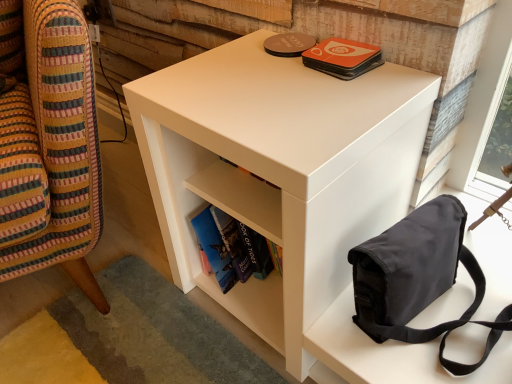
Question: Does white matte nightstand at center have a greater height compared to white matte bookshelf at center?

Choices:
 (A) yes
 (B) no

Answer: (B)

Question: Can you confirm if white matte nightstand at center is bigger than white matte bookshelf at center?

Choices:
 (A) yes
 (B) no

Answer: (A)

Question: Would you say white matte nightstand at center is a long distance from white matte bookshelf at center?

Choices:
 (A) yes
 (B) no

Answer: (B)

Question: Is white matte nightstand at center at the right side of white matte bookshelf at center?

Choices:
 (A) yes
 (B) no

Answer: (B)

Question: Can we say white matte nightstand at center lies outside white matte bookshelf at center?

Choices:
 (A) no
 (B) yes

Answer: (B)

Question: Does white matte nightstand at center have a smaller size compared to white matte bookshelf at center?

Choices:
 (A) no
 (B) yes

Answer: (A)

Question: Considering the relative sizes of orange matte coaster at upper center and white matte side table at lower right in the image provided, is orange matte coaster at upper center taller than white matte side table at lower right?

Choices:
 (A) no
 (B) yes

Answer: (A)

Question: Is orange matte coaster at upper center not within white matte side table at lower right?

Choices:
 (A) yes
 (B) no

Answer: (A)

Question: Can white matte side table at lower right be found inside orange matte coaster at upper center?

Choices:
 (A) yes
 (B) no

Answer: (B)

Question: From a real-world perspective, is orange matte coaster at upper center over white matte side table at lower right?

Choices:
 (A) yes
 (B) no

Answer: (A)

Question: From a real-world perspective, is orange matte coaster at upper center physically below white matte side table at lower right?

Choices:
 (A) no
 (B) yes

Answer: (A)

Question: Does orange matte coaster at upper center have a smaller size compared to white matte side table at lower right?

Choices:
 (A) no
 (B) yes

Answer: (B)

Question: Is white matte side table at lower right facing towards white matte bookshelf at center?

Choices:
 (A) no
 (B) yes

Answer: (A)